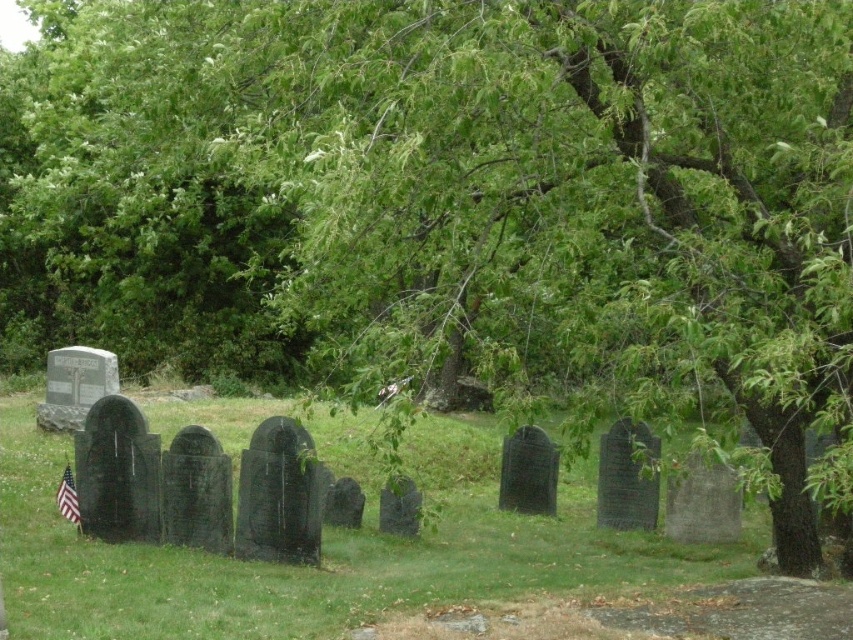
Question: Which point is closer to the camera?

Choices:
 (A) green grass at center
 (B) american flag at lower left

Answer: (A)

Question: Does green grass at center lie in front of american flag at lower left?

Choices:
 (A) yes
 (B) no

Answer: (A)

Question: Observing the image, what is the correct spatial positioning of green grass at center in reference to american flag at lower left?

Choices:
 (A) left
 (B) right

Answer: (B)

Question: Among these points, which one is nearest to the camera?

Choices:
 (A) (358, 449)
 (B) (68, 499)

Answer: (B)

Question: Can you confirm if green grass at center is positioned below american flag at lower left?

Choices:
 (A) no
 (B) yes

Answer: (A)